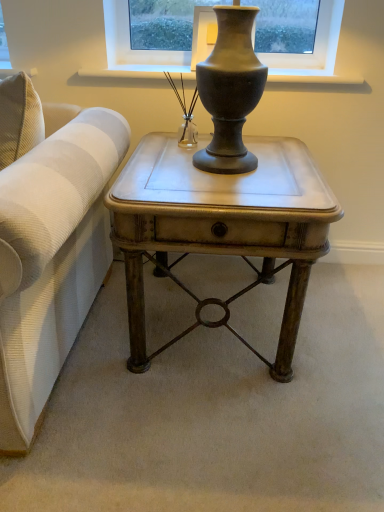
The width and height of the screenshot is (384, 512). In order to click on vacant space situated above matte gray vase at upper center (from a real-world perspective) in this screenshot , I will do `click(185, 67)`.